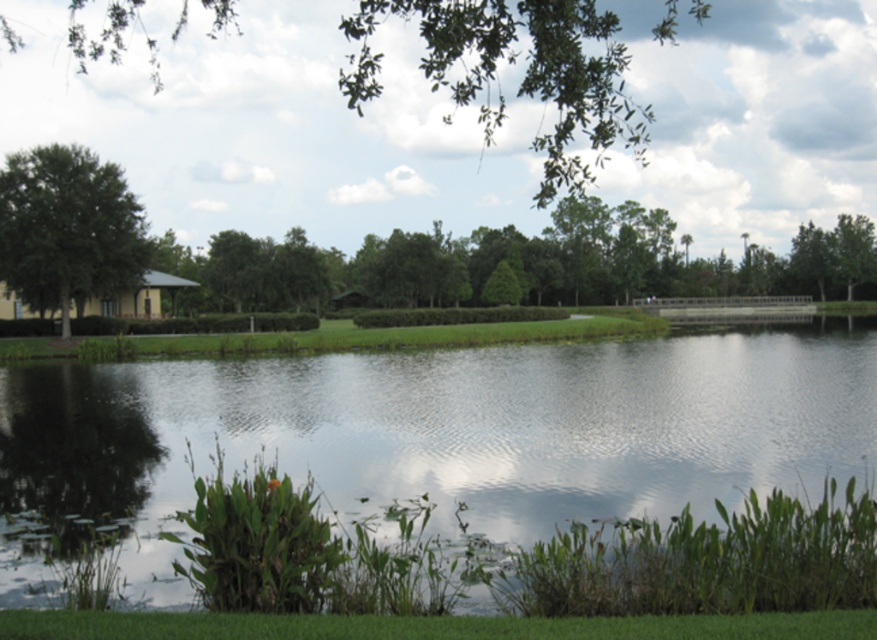
Question: Can you confirm if clear water at center is thinner than green leafy tree at left?

Choices:
 (A) no
 (B) yes

Answer: (A)

Question: Which is nearer to the clear water at center?

Choices:
 (A) green leafy tree at upper center
 (B) green leafy tree at left

Answer: (B)

Question: Does clear water at center appear on the right side of green leafy tree at upper center?

Choices:
 (A) yes
 (B) no

Answer: (B)

Question: Is clear water at center thinner than green leafy tree at left?

Choices:
 (A) yes
 (B) no

Answer: (B)

Question: Among these objects, which one is nearest to the camera?

Choices:
 (A) clear water at center
 (B) green leafy tree at left

Answer: (A)

Question: Which of these objects is positioned farthest from the clear water at center?

Choices:
 (A) green leafy tree at upper center
 (B) green leafy tree at left

Answer: (A)